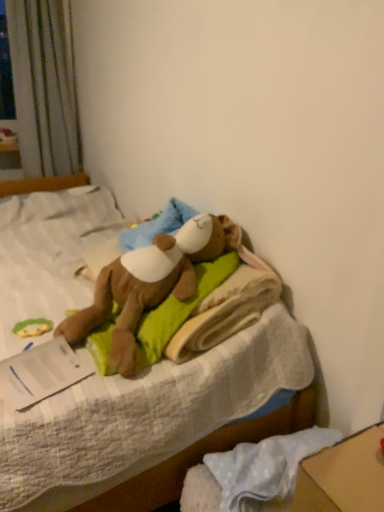
Question: From the image's perspective, is green fabric toy at lower left above or below soft plush bear at center?

Choices:
 (A) above
 (B) below

Answer: (B)

Question: In terms of size, does green fabric toy at lower left appear bigger or smaller than soft plush bear at center?

Choices:
 (A) big
 (B) small

Answer: (B)

Question: From their relative heights in the image, would you say green fabric toy at lower left is taller or shorter than soft plush bear at center?

Choices:
 (A) tall
 (B) short

Answer: (B)

Question: From the image's perspective, is soft plush bear at center positioned above or below green fabric toy at lower left?

Choices:
 (A) above
 (B) below

Answer: (A)

Question: Considering their positions, is soft plush bear at center located in front of or behind green fabric toy at lower left?

Choices:
 (A) behind
 (B) front

Answer: (B)

Question: Based on their positions, is soft plush bear at center located to the left or right of green fabric toy at lower left?

Choices:
 (A) right
 (B) left

Answer: (B)

Question: In terms of width, does soft plush bear at center look wider or thinner when compared to green fabric toy at lower left?

Choices:
 (A) thin
 (B) wide

Answer: (B)